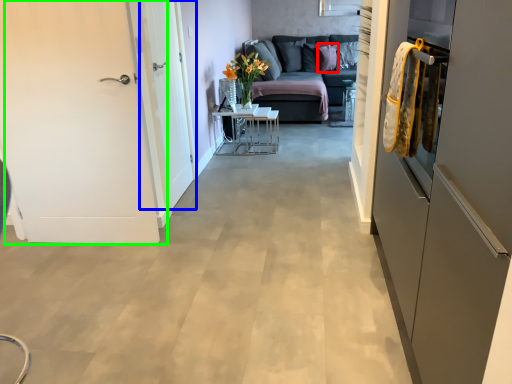
Question: Based on their relative distances, which object is farther from pillow (highlighted by a red box)? Choose from door (highlighted by a blue box) and door (highlighted by a green box).

Choices:
 (A) door
 (B) door

Answer: (B)